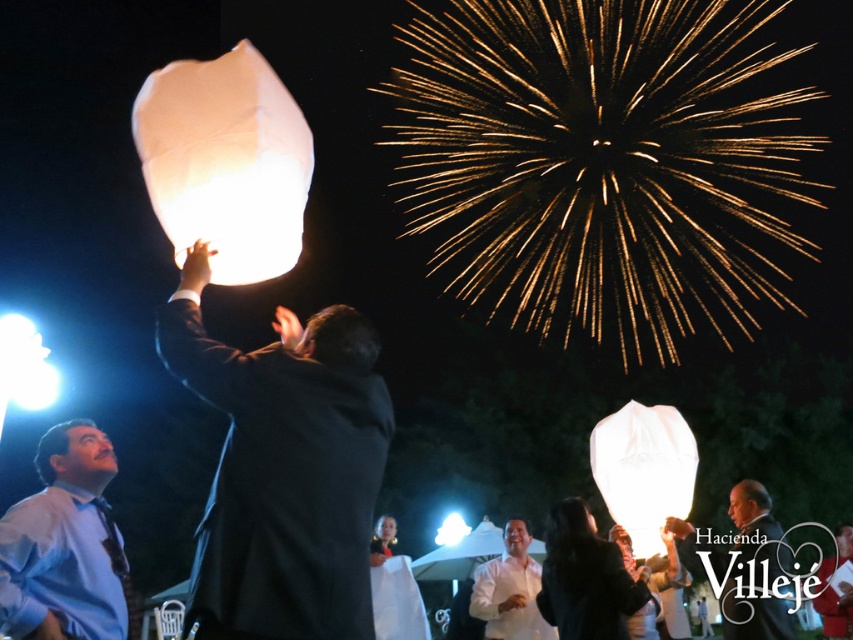
Question: Observing the image, what is the correct spatial positioning of white translucent paper lantern at upper center in reference to white paper lantern at upper center?

Choices:
 (A) below
 (B) above

Answer: (B)

Question: Which point appears farthest from the camera in this image?

Choices:
 (A) (635, 440)
 (B) (321, 332)
 (C) (508, 589)
 (D) (786, 552)

Answer: (A)

Question: Does matte blue shirt at lower left appear under white translucent paper lantern at upper center?

Choices:
 (A) yes
 (B) no

Answer: (B)

Question: Among these objects, which one is nearest to the camera?

Choices:
 (A) matte blue shirt at lower left
 (B) white matte shirt at center
 (C) white paper lantern at upper center

Answer: (A)

Question: In this image, where is matte blue shirt at lower left located relative to smooth black suit at center?

Choices:
 (A) above
 (B) below

Answer: (A)

Question: Among these objects, which one is nearest to the camera?

Choices:
 (A) white paper lantern at upper center
 (B) matte blue shirt at lower left
 (C) matte black suit at center
 (D) white translucent paper lantern at upper left

Answer: (C)